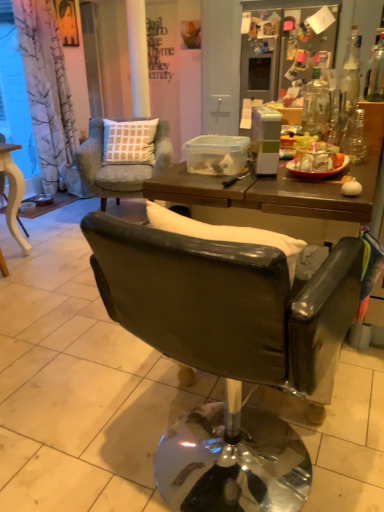
Question: Can you confirm if light blue fabric chair at upper left, which is the 1th chair in back-to-front order, is positioned to the right of brown wooden table at center?

Choices:
 (A) yes
 (B) no

Answer: (B)

Question: Can you confirm if light blue fabric chair at upper left, arranged as the second chair when viewed from the left, is thinner than brown wooden table at center?

Choices:
 (A) no
 (B) yes

Answer: (A)

Question: Is light blue fabric chair at upper left, which appears as the third chair when viewed from the front, to the left of brown wooden table at center from the viewer's perspective?

Choices:
 (A) yes
 (B) no

Answer: (A)

Question: Is light blue fabric chair at upper left, which ranks as the 2th chair in right-to-left order, in front of brown wooden table at center?

Choices:
 (A) no
 (B) yes

Answer: (A)

Question: Is matte black portrait at upper left inside or outside of leather-like black chair at center, which is the third chair in back-to-front order?

Choices:
 (A) inside
 (B) outside

Answer: (B)

Question: From a real-world perspective, is matte black portrait at upper left positioned above or below leather-like black chair at center, the 1th chair in the front-to-back sequence?

Choices:
 (A) above
 (B) below

Answer: (A)

Question: Looking at their shapes, would you say matte black portrait at upper left is wider or thinner than leather-like black chair at center, which ranks as the 3th chair in left-to-right order?

Choices:
 (A) thin
 (B) wide

Answer: (A)

Question: In the image, is matte black portrait at upper left positioned in front of or behind leather-like black chair at center, which ranks as the 3th chair in left-to-right order?

Choices:
 (A) front
 (B) behind

Answer: (B)

Question: Is transparent glass bottle at upper right, the 1th bottle viewed from the right, inside the boundaries of brown wooden table at center, or outside?

Choices:
 (A) outside
 (B) inside

Answer: (A)

Question: From a real-world perspective, is transparent glass bottle at upper right, which ranks as the third bottle in left-to-right order, above or below brown wooden table at center?

Choices:
 (A) below
 (B) above

Answer: (B)

Question: Is point (350, 73) closer or farther from the camera than point (299, 197)?

Choices:
 (A) closer
 (B) farther

Answer: (B)

Question: Considering the positions of transparent glass bottle at upper right, the 1th bottle viewed from the right, and brown wooden table at center in the image, is transparent glass bottle at upper right, the 1th bottle viewed from the right, taller or shorter than brown wooden table at center?

Choices:
 (A) tall
 (B) short

Answer: (B)

Question: Considering the relative positions of matte yellow wooden table at left, the 2th chair from the back, and clear glass bottle at upper right, the 3th bottle from the right, in the image provided, is matte yellow wooden table at left, the 2th chair from the back, to the left or to the right of clear glass bottle at upper right, the 3th bottle from the right,?

Choices:
 (A) left
 (B) right

Answer: (A)

Question: From the image's perspective, is matte yellow wooden table at left, which ranks as the 3th chair in right-to-left order, located above or below clear glass bottle at upper right, the 3th bottle from the right?

Choices:
 (A) above
 (B) below

Answer: (B)